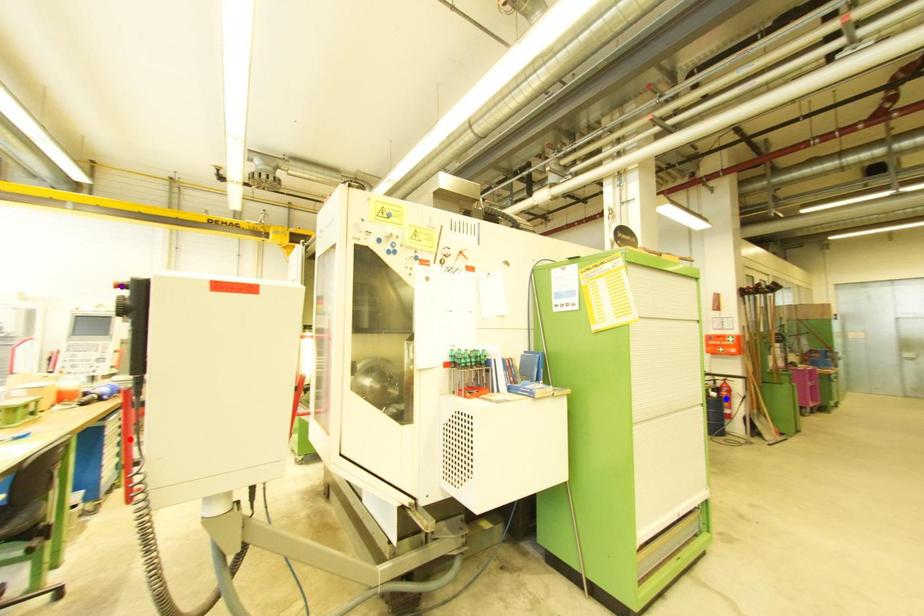
Order these from nearest to farthest:
- red point
- blue point
- purple point

purple point → red point → blue point